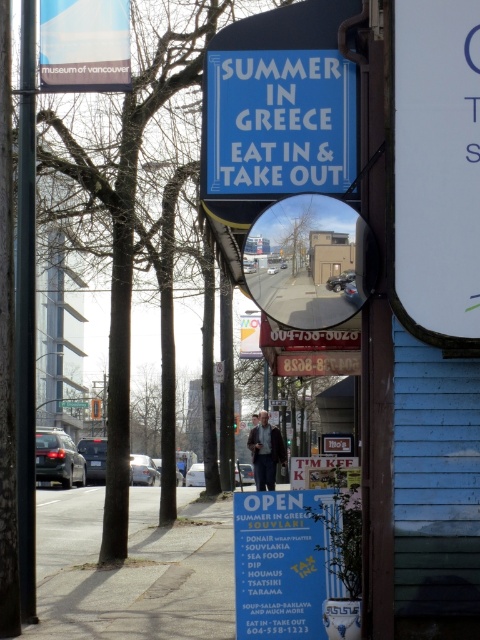
Between white paper signboard at center and black metal pole at left, which one is positioned higher?

Positioned higher is black metal pole at left.

Can you confirm if white paper signboard at center is positioned above black metal pole at left?

No, white paper signboard at center is not above black metal pole at left.

Which is behind, point (292, 621) or point (22, 577)?

The point (22, 577) is more distant.

You are a GUI agent. You are given a task and a screenshot of the screen. Output one action in this format:
    pyautogui.click(x=<x>, y=<y>)
    Task: Click on the white paper signboard at center
    
    Given the screenshot: What is the action you would take?
    click(x=282, y=564)

Can you confirm if white paper at upper right is bigger than black metal pole at left?

No, white paper at upper right is not bigger than black metal pole at left.

Is white paper at upper right shorter than black metal pole at left?

Yes, white paper at upper right is shorter than black metal pole at left.

Is point (387, 24) closer to viewer compared to point (23, 388)?

Yes, it is in front of point (23, 388).

This screenshot has width=480, height=640. Find the location of `white paper at upper right`. white paper at upper right is located at coordinates (434, 170).

Between white paper signboard at center and green plastic street sign at upper center, which one is positioned higher?

white paper signboard at center

Is point (316, 524) behind point (80, 401)?

No, (316, 524) is in front of (80, 401).

At what (x,y) coordinates should I click in order to perform the action: click on white paper signboard at center. Please return your answer as a coordinate pair (x, y). The width and height of the screenshot is (480, 640). Looking at the image, I should click on [282, 564].